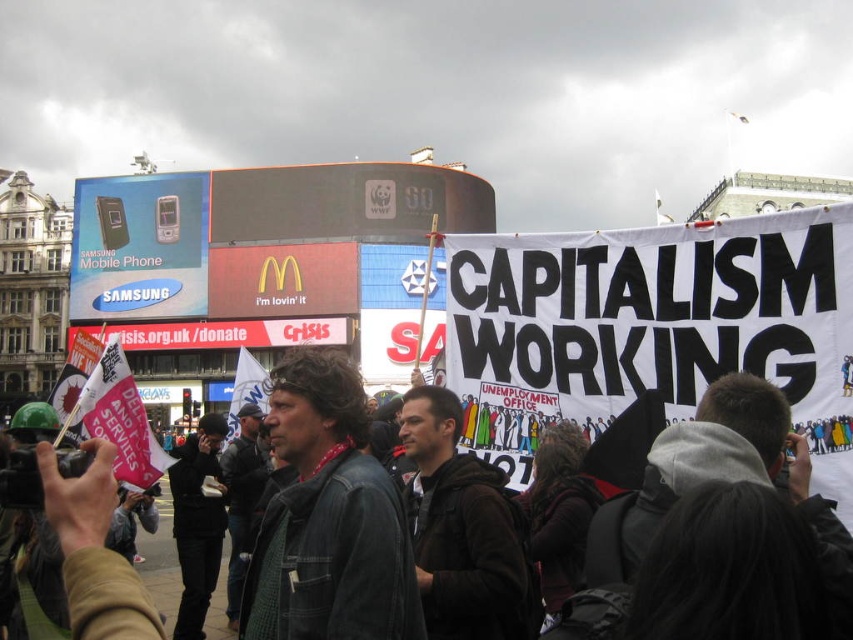
Looking at this image, you are a photographer at the protest scene. You need to capture a photo that includes both the dark brown leather jacket at center and the denim jacket at center. Which jacket should you focus on first to ensure both are in frame?

The dark brown leather jacket at center is located above the denim jacket at center, so you should focus on the denim jacket at center first to ensure both are in frame.

You are a photographer standing in the protest scene. You need to take a photo of both the dark brown leather jacket at center and the denim jacket at center. Which jacket should you focus on first if you want to capture the one that is shorter?

The dark brown leather jacket at center is shorter than the denim jacket at center, so you should focus on the dark brown leather jacket at center first to capture the shorter one.